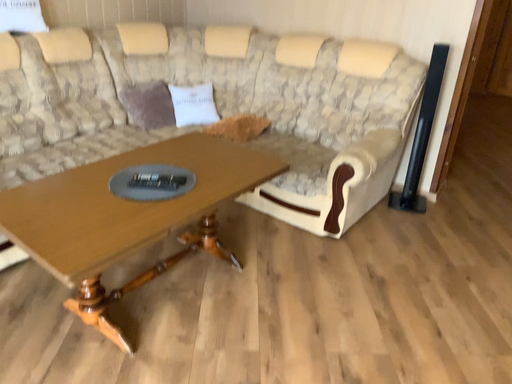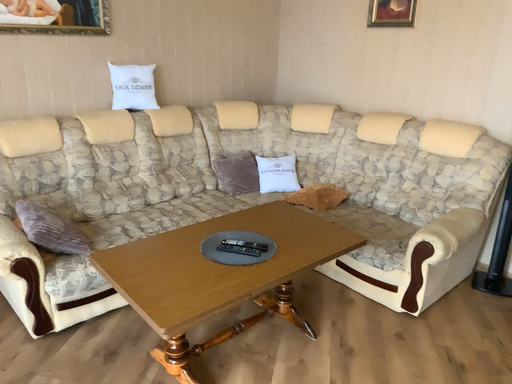
Question: Which way did the camera rotate in the video?

Choices:
 (A) rotated left
 (B) rotated right

Answer: (A)